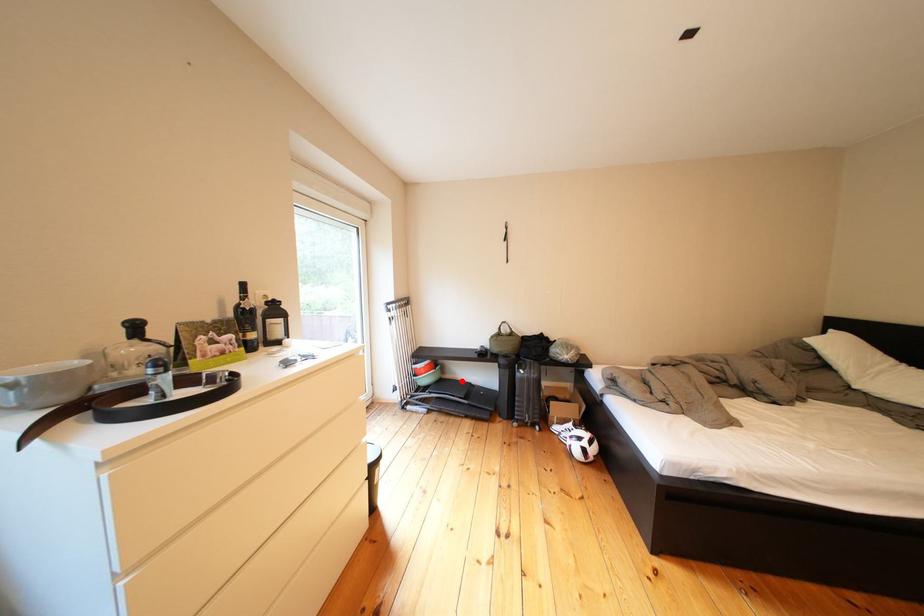
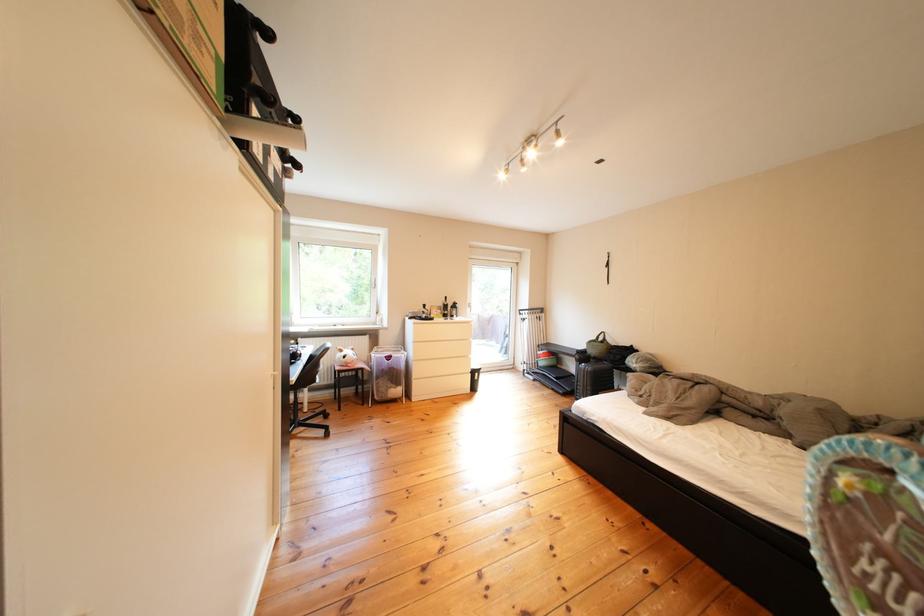
Question: I am providing you with two images of the same scene from different viewpoints. In image1, a red point is highlighted. Considering the same 3D point in image2, which of the following is correct?

Choices:
 (A) It is closer
 (B) It is farther

Answer: (A)